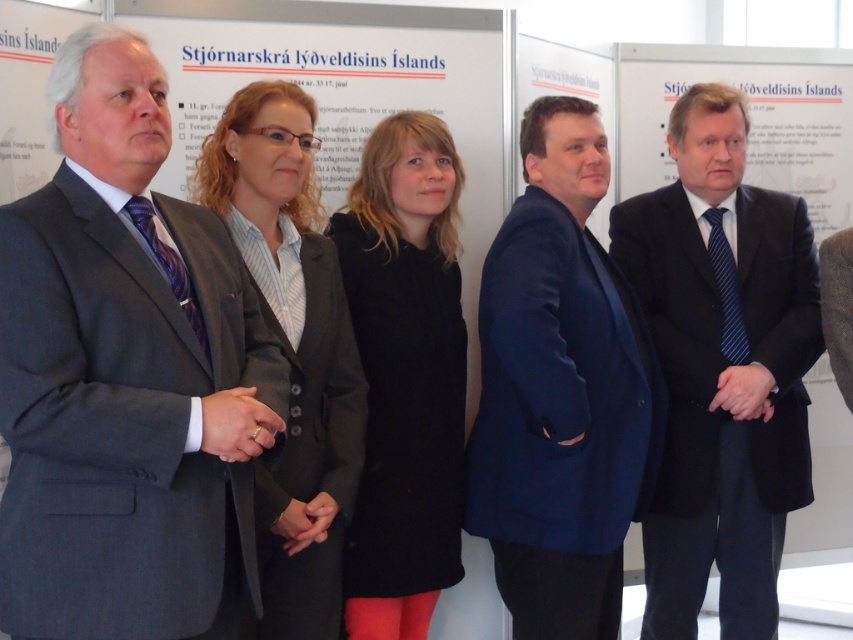
Between blue fabric suit at center and matte black blazer at center, which one has less height?

matte black blazer at center

Between blue fabric suit at center and matte black blazer at center, which one is positioned higher?

matte black blazer at center is higher up.

Measure the distance between point [534,259] and camera.

Point [534,259] is 2.32 meters away from camera.

Identify the location of blue fabric suit at center. The width and height of the screenshot is (853, 640). pos(560,392).

Does matte black suit at center have a larger size compared to black wool coat at center?

Correct, matte black suit at center is larger in size than black wool coat at center.

Measure the distance between matte black suit at center and black wool coat at center.

matte black suit at center is 78.35 centimeters away from black wool coat at center.

Does point (744, 339) come behind point (392, 579)?

Yes, point (744, 339) is behind point (392, 579).

In order to click on matte black suit at center in this screenshot , I will do `click(722, 369)`.

In the scene shown: Which of these two, matte gray suit at left or matte black suit at center, stands taller?

With more height is matte black suit at center.

What do you see at coordinates (126, 378) in the screenshot?
I see `matte gray suit at left` at bounding box center [126, 378].

You are a GUI agent. You are given a task and a screenshot of the screen. Output one action in this format:
    pyautogui.click(x=<x>, y=<y>)
    Task: Click on the matte gray suit at left
    The width and height of the screenshot is (853, 640).
    Given the screenshot: What is the action you would take?
    pyautogui.click(x=126, y=378)